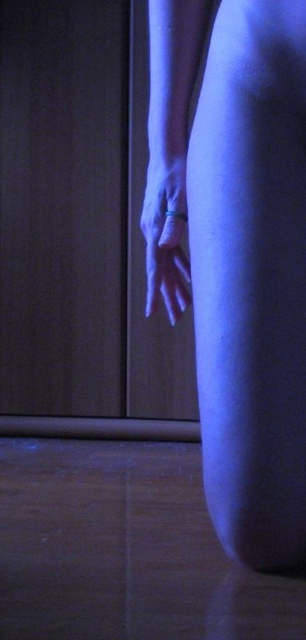
You are a photographer adjusting lighting for a closeup shot. You notice the smooth skin at center and the matte silver ring at lower center. Which object is closer to the camera lens?

The smooth skin at center is positioned under the matte silver ring at lower center, so the matte silver ring at lower center is closer to the camera lens.

You are standing in a dimly lit room with a wooden floor and a person whose hand is near a wooden door. There are two points marked in the image. If you were to walk towards the wooden door, which point would you encounter first, point (282,358) or point (182,291)?

Point (282,358) is in front of point (182,291), so you would encounter point (282,358) first when walking towards the wooden door.